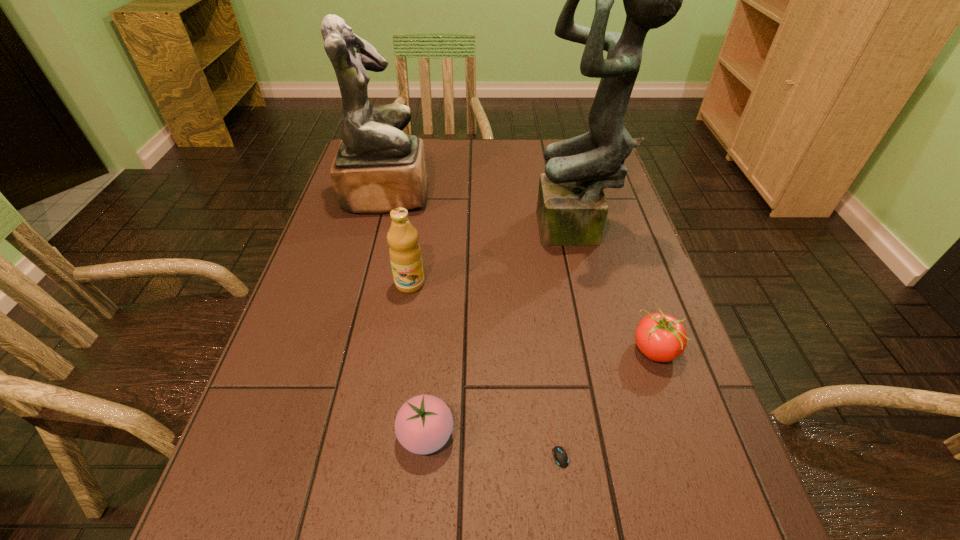
This screenshot has width=960, height=540. Find the location of `vacant region located 0.370m on the face of the tallest object`. vacant region located 0.370m on the face of the tallest object is located at coordinates (397, 232).

You are a GUI agent. You are given a task and a screenshot of the screen. Output one action in this format:
    pyautogui.click(x=<x>, y=<y>)
    Task: Click on the free spot located 0.300m on the face of the tallest object
    This screenshot has height=540, width=960.
    Given the screenshot: What is the action you would take?
    pyautogui.click(x=423, y=232)

Where is `vacant region located 0.060m on the face of the tallest object`? vacant region located 0.060m on the face of the tallest object is located at coordinates (514, 232).

In order to click on vacant space located 0.230m in a relaxed pose on the shorter sculpture in this screenshot , I will do `click(507, 194)`.

Locate an element on the screen. vacant space situated on the label of the third tallest object is located at coordinates (381, 470).

Where is `vacant point located 0.080m on the back of the farther tomato`? This screenshot has width=960, height=540. vacant point located 0.080m on the back of the farther tomato is located at coordinates (637, 301).

Identify the location of blank area located 0.350m on the right of the left tomato. coord(653,435).

Locate an element on the screen. This screenshot has height=540, width=960. vacant space located on the back of the shortest object is located at coordinates (543, 333).

This screenshot has height=540, width=960. I want to click on object located at the far edge, so click(x=377, y=168).

This screenshot has height=540, width=960. Find the location of `object situated at the left edge`. object situated at the left edge is located at coordinates (377, 168).